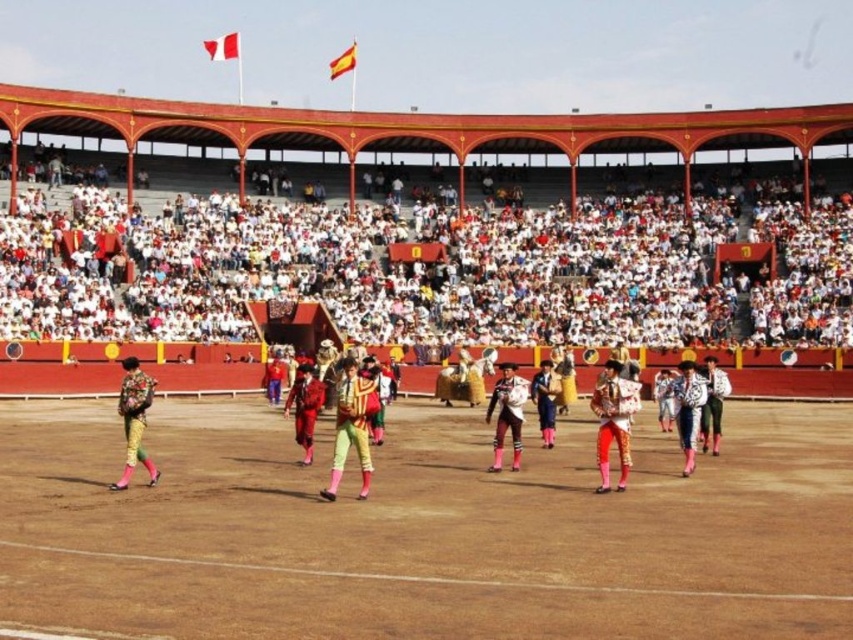
You are standing at the center of the arena in the bullfighting scene. You notice a point marked at coordinates [352,426]. What object is located at that point?

The point at coordinates [352,426] marks yellowgreen fabric pants at center.